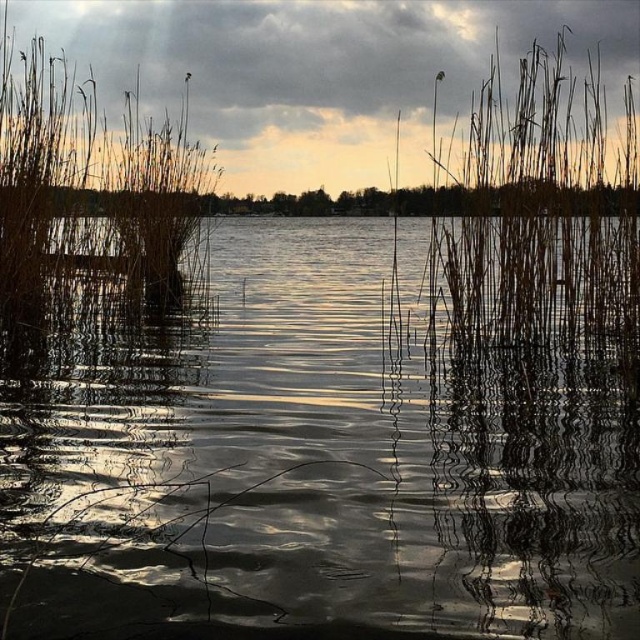
You are an artist planning to paint the scene. You want to ensure the cloudy sky at upper center and the brown dry reed at right are proportionally accurate. Which object should you make wider in your painting?

The cloudy sky at upper center should be made wider in the painting since its width is larger than the brown dry reed at right.

You are standing at the edge of the lakeside scene. You want to locate the glistening water at center. According to the coordinates provided, in which direction should you look relative to your position?

You should look towards the center of the scene because the glistening water at center is located at point [316,464], which corresponds to the central area.

You are an artist trying to paint this lakeside scene. You want to ensure the brown dry reed at right and the brown reeds at left are proportionally accurate. Which group of reeds should you paint as larger in your artwork?

The brown reeds at left should be painted as larger because they occupy more space than the brown dry reed at right.